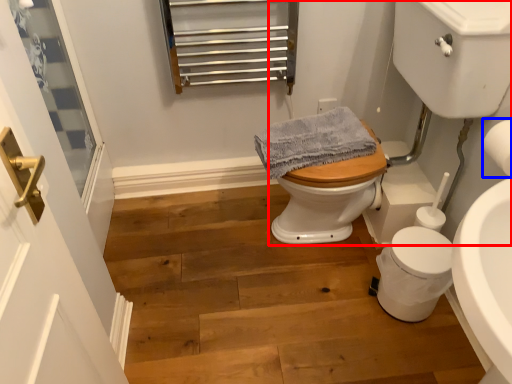
Question: Which point is closer to the camera, sink (highlighted by a red box) or toilet paper (highlighted by a blue box)?

Choices:
 (A) sink
 (B) toilet paper

Answer: (A)